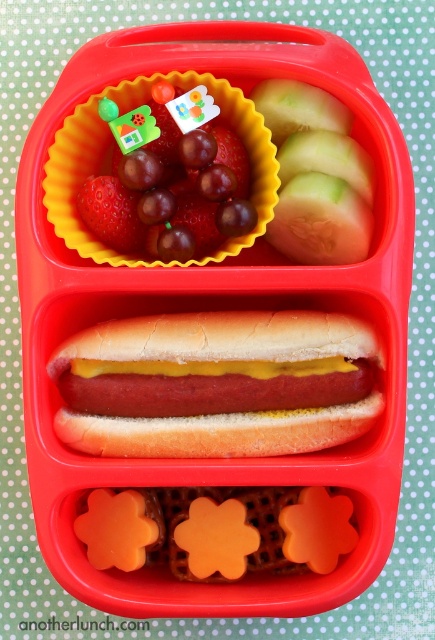
Does yellow mustard hot dog at center lie in front of shiny red grapes at upper left?

No, it is behind shiny red grapes at upper left.

Between yellow mustard hot dog at center and shiny red grapes at upper left, which one has less height?

With less height is yellow mustard hot dog at center.

Between point (126, 403) and point (218, 125), which one is positioned in front?

Point (126, 403)

You are a GUI agent. You are given a task and a screenshot of the screen. Output one action in this format:
    pyautogui.click(x=<x>, y=<y>)
    Task: Click on the yellow mustard hot dog at center
    Image resolution: width=435 pixels, height=640 pixels.
    Given the screenshot: What is the action you would take?
    pyautogui.click(x=217, y=385)